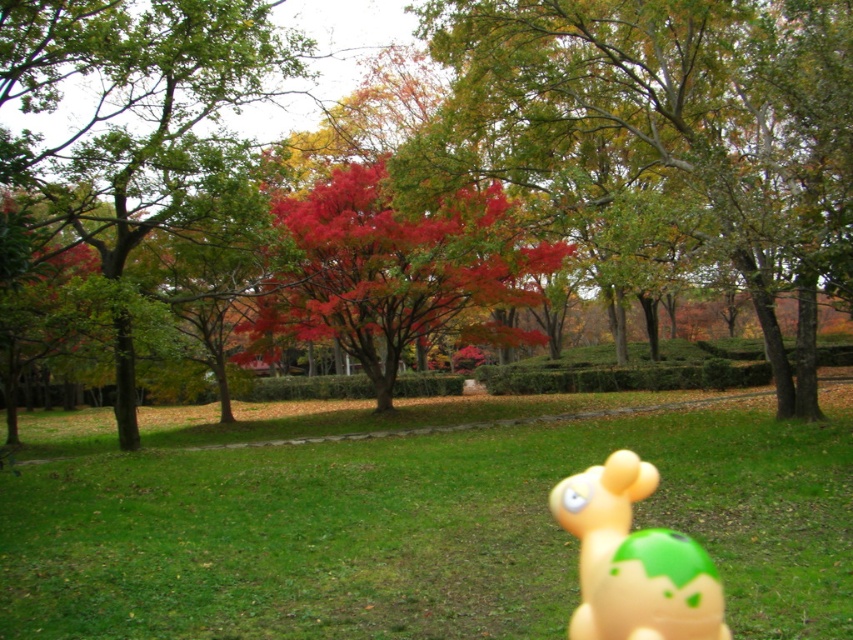
Between green leafy tree at upper center and vivid red leaves at center, which one is positioned lower?

vivid red leaves at center is lower down.

Image resolution: width=853 pixels, height=640 pixels. I want to click on green leafy tree at upper center, so click(x=660, y=136).

This screenshot has width=853, height=640. What are the coordinates of `green leafy tree at upper center` in the screenshot? It's located at (660, 136).

Does point (543, 445) lie in front of point (631, 634)?

That is False.

You are a GUI agent. You are given a task and a screenshot of the screen. Output one action in this format:
    pyautogui.click(x=<x>, y=<y>)
    Task: Click on the green grass at center
    The height and width of the screenshot is (640, 853).
    Given the screenshot: What is the action you would take?
    pyautogui.click(x=421, y=531)

Is green leafy tree at upper center shorter than rubber duck at lower right?

Incorrect, green leafy tree at upper center's height does not fall short of rubber duck at lower right's.

Who is more forward, (815, 19) or (659, 531)?

Point (659, 531) is in front.

Find the location of a particular element. This screenshot has height=640, width=853. green leafy tree at upper center is located at coordinates (660, 136).